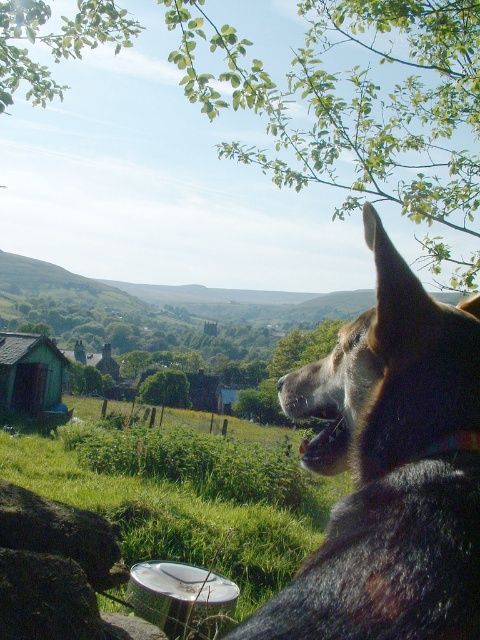
You are standing in the rural scene and want to place a small toy between the smooth gray rock at lower left and the green leafy tree at center. Can the toy fit between them if the toy requires 1 meter of space?

The smooth gray rock at lower left has a lesser width compared to green leafy tree at center. However, the exact distance between them isn not specified in the objects description. Therefore, it is uncertain if the toy will fit.

You are standing in the rural scene and want to pick up the brushed metal bucket at lower center. Which direction should you move relative to the green leafy tree at center?

The brushed metal bucket at lower center is to the right of the green leafy tree at center, so you should move to the right of the green leafy tree at center to reach it.